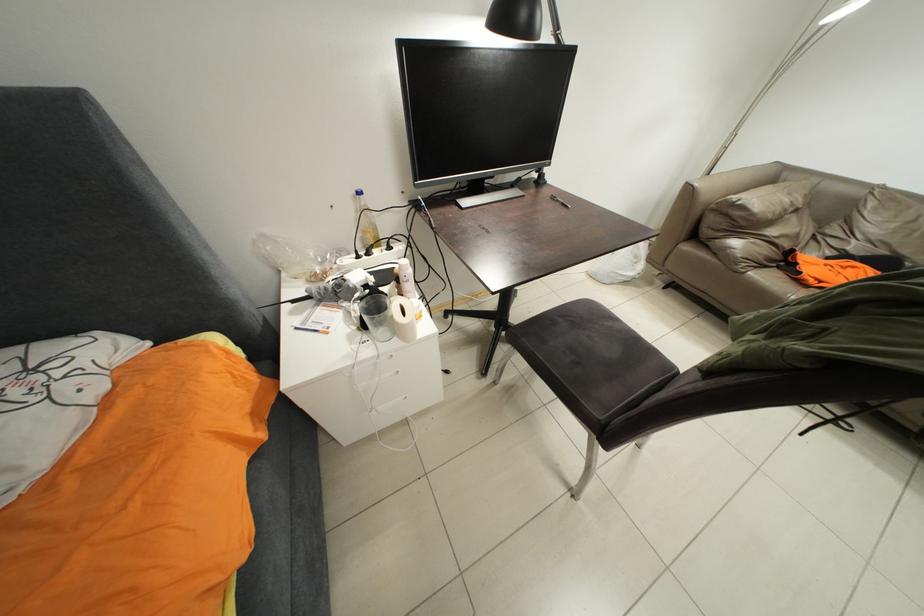
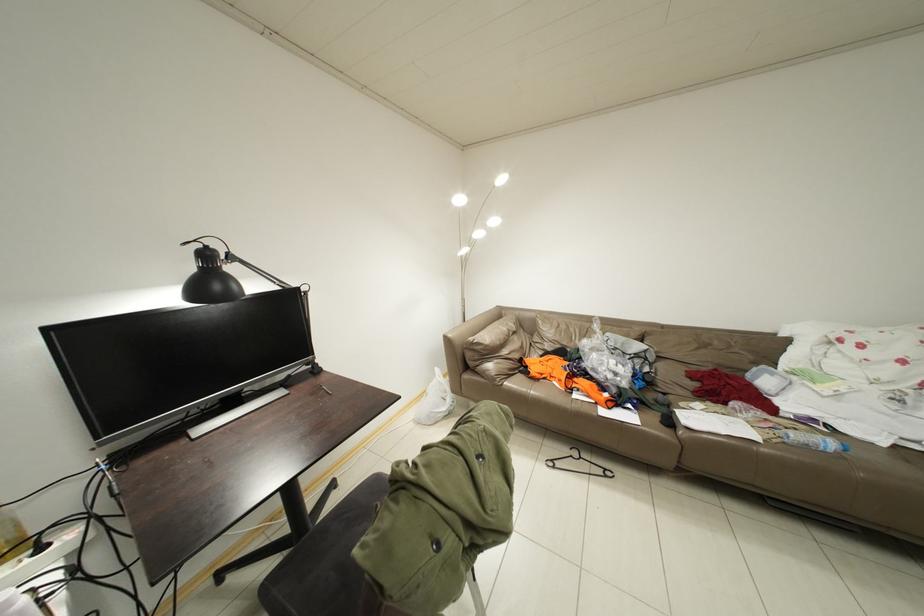
The first image is from the beginning of the video and the second image is from the end. How did the camera likely rotate when shooting the video?

The rotation direction of the camera is right-up.